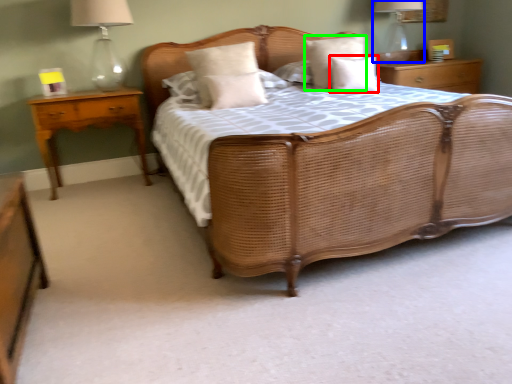
Question: Which is farther away from pillow (highlighted by a red box)? bedside lamp (highlighted by a blue box) or pillow (highlighted by a green box)?

Choices:
 (A) bedside lamp
 (B) pillow

Answer: (A)